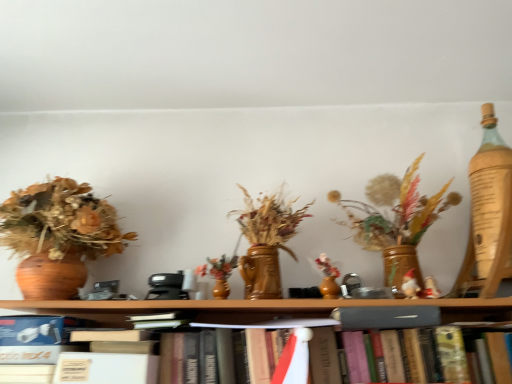
Question: Can you see hardcover book at center touching matte gray book at center?

Choices:
 (A) no
 (B) yes

Answer: (B)

Question: Is the position of hardcover book at center more distant than that of matte gray book at center?

Choices:
 (A) yes
 (B) no

Answer: (B)

Question: Is hardcover book at center bigger than matte gray book at center?

Choices:
 (A) yes
 (B) no

Answer: (A)

Question: Could you tell me if hardcover book at center is facing matte gray book at center?

Choices:
 (A) no
 (B) yes

Answer: (B)

Question: Would you say hardcover book at center is a long distance from matte gray book at center?

Choices:
 (A) yes
 (B) no

Answer: (B)

Question: Is hardcover book at center smaller than matte gray book at center?

Choices:
 (A) yes
 (B) no

Answer: (B)

Question: Can you confirm if matte gray book at center is smaller than hardcover book at center?

Choices:
 (A) yes
 (B) no

Answer: (A)

Question: Is hardcover book at center inside matte gray book at center?

Choices:
 (A) no
 (B) yes

Answer: (A)

Question: Does matte gray book at center have a lesser width compared to hardcover book at center?

Choices:
 (A) yes
 (B) no

Answer: (A)

Question: Are matte gray book at center and hardcover book at center making contact?

Choices:
 (A) yes
 (B) no

Answer: (A)

Question: Is matte gray book at center positioned far away from hardcover book at center?

Choices:
 (A) yes
 (B) no

Answer: (B)

Question: Considering the relative sizes of matte gray book at center and hardcover book at center in the image provided, is matte gray book at center taller than hardcover book at center?

Choices:
 (A) yes
 (B) no

Answer: (B)

Question: In terms of size, does hardcover book at center appear bigger or smaller than matte gray book at center?

Choices:
 (A) small
 (B) big

Answer: (B)